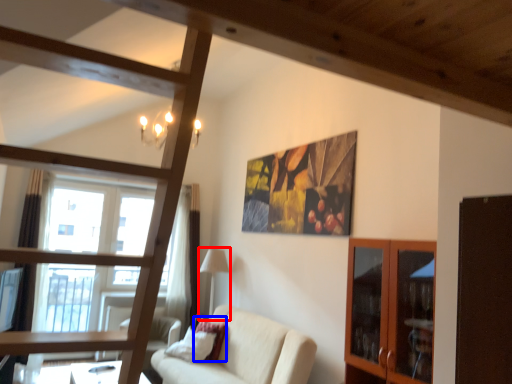
Question: Which object appears closest to the camera in this image, lamp (highlighted by a red box) or pillow (highlighted by a blue box)?

Choices:
 (A) lamp
 (B) pillow

Answer: (B)